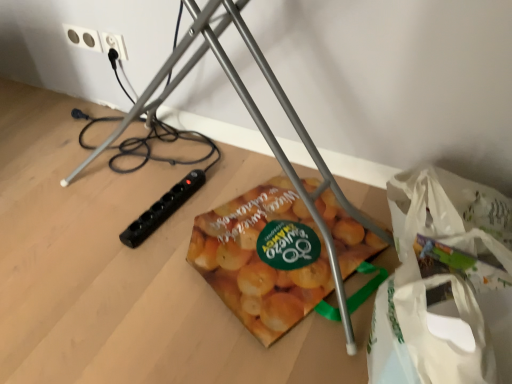
Where is `free space to the left of matte plastic bag of sweet potatoes at center`? free space to the left of matte plastic bag of sweet potatoes at center is located at coordinates (118, 277).